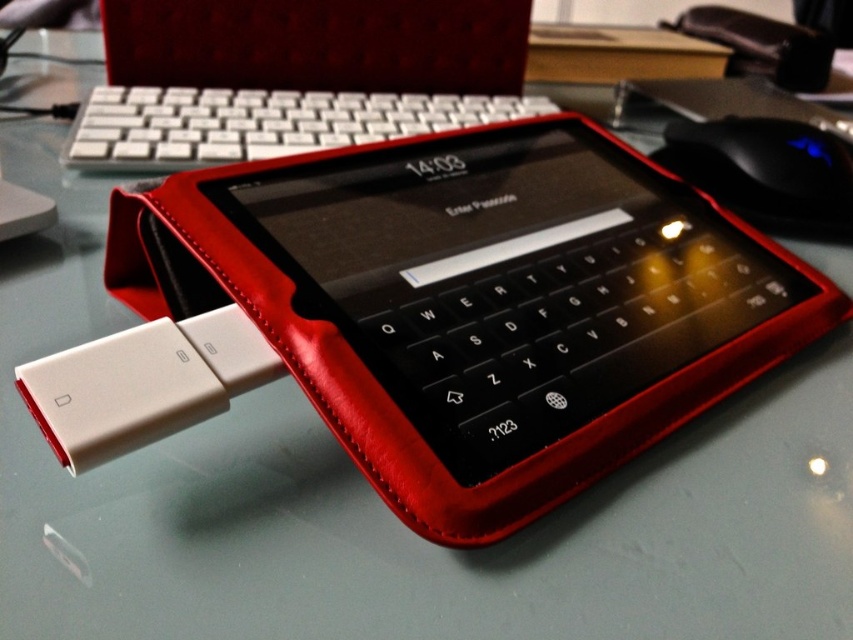
Does white plastic keyboard at upper center have a larger size compared to black plastic mouse at upper right?

Yes.

Can you confirm if white plastic keyboard at upper center is taller than black plastic mouse at upper right?

No, white plastic keyboard at upper center is not taller than black plastic mouse at upper right.

What do you see at coordinates (260, 122) in the screenshot?
I see `white plastic keyboard at upper center` at bounding box center [260, 122].

Where is `white plastic keyboard at upper center`? white plastic keyboard at upper center is located at coordinates (260, 122).